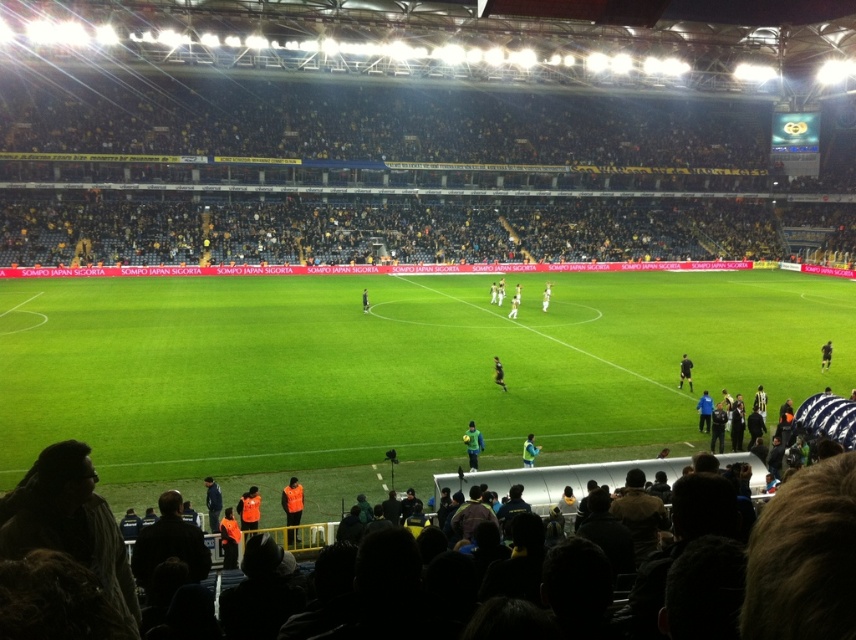
You are a photographer standing at the edge of the soccer field. You want to take a photo that includes both the point at the edge of the field near the center of the image and another point further back on the field. Which of the two points, point (494, 356) or point (361, 298), should you focus on first to ensure both are in clear view?

You should focus on point (494, 356) first because it is closer to the viewer than point (361, 298). By focusing on the closer point, the further point will also be in acceptable focus due to depth of field.

You are a photographer standing at the edge of the soccer field. You want to capture a photo where both the black matte referee at right and the dark blue jersey at center are visible. Considering their sizes, which object should you focus on first to ensure both are in frame?

The black matte referee at right is larger in size compared to the dark blue jersey at center, so you should focus on the black matte referee at right first to ensure both are in frame.

You are a photographer at the soccer stadium. You need to take a photo of the two players wearing the dark blue jersey at center and black jersey at center. Which player should you focus on first if you want to capture them from left to right in the frame?

You should focus on the black jersey at center first because the dark blue jersey at center is to the right of it, so arranging them from left to right would place the black jersey at center on the left followed by the dark blue jersey at center.